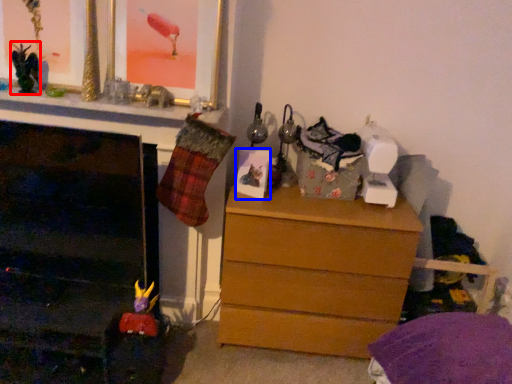
Question: Which object appears closest to the camera in this image, toy (highlighted by a red box) or picture frame (highlighted by a blue box)?

Choices:
 (A) toy
 (B) picture frame

Answer: (A)